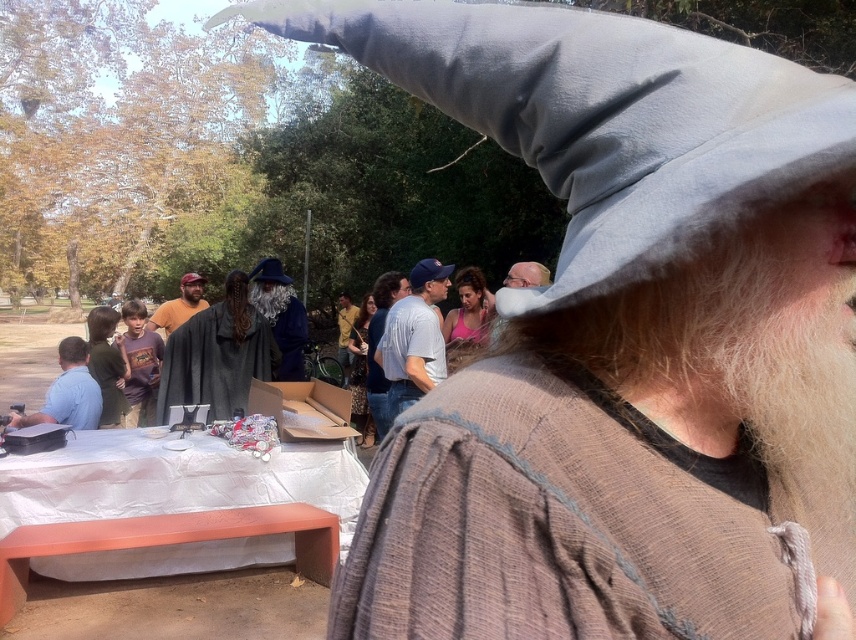
You are standing at the edge of the park and see the orange painted wood picnic table at lower left and the yellow shirt at center. Which object is closer to you?

The orange painted wood picnic table at lower left is closer to you because it is positioned below the yellow shirt at center, indicating it is in a lower, nearer position from your viewpoint.

You are organizing a costume party and need to decide which shirt to wear. You have the light blue cotton shirt at left and the yellow shirt at center. Which shirt is smaller in size?

The light blue cotton shirt at left has a smaller size compared to the yellow shirt at center, so the light blue cotton shirt at left is the smaller one.